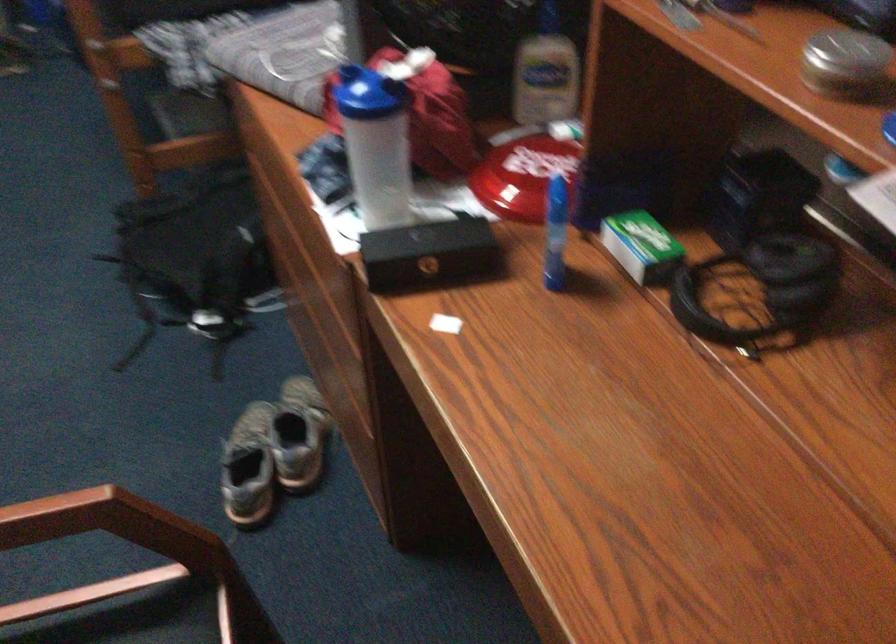
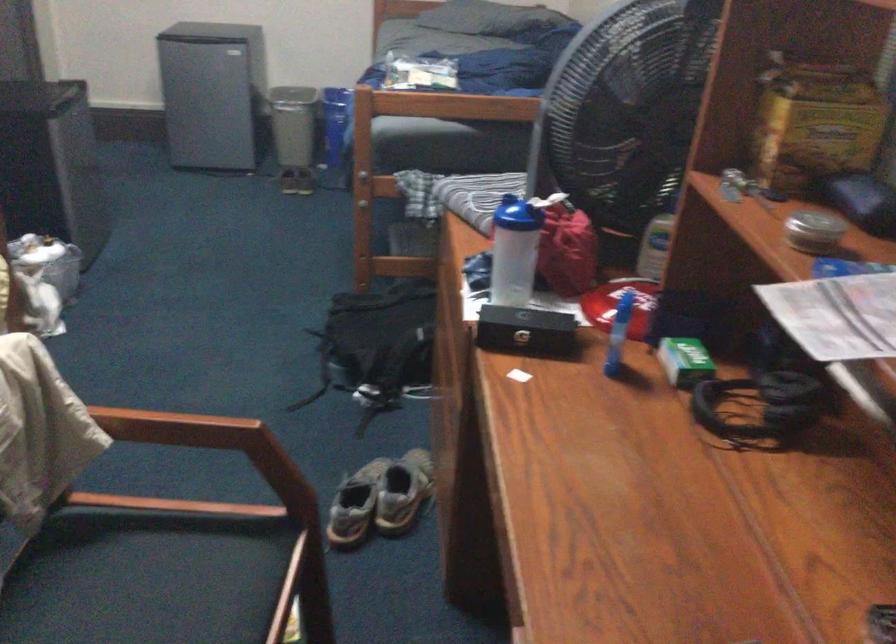
Locate, in the second image, the point that corresponds to (x=645, y=248) in the first image.

(685, 361)